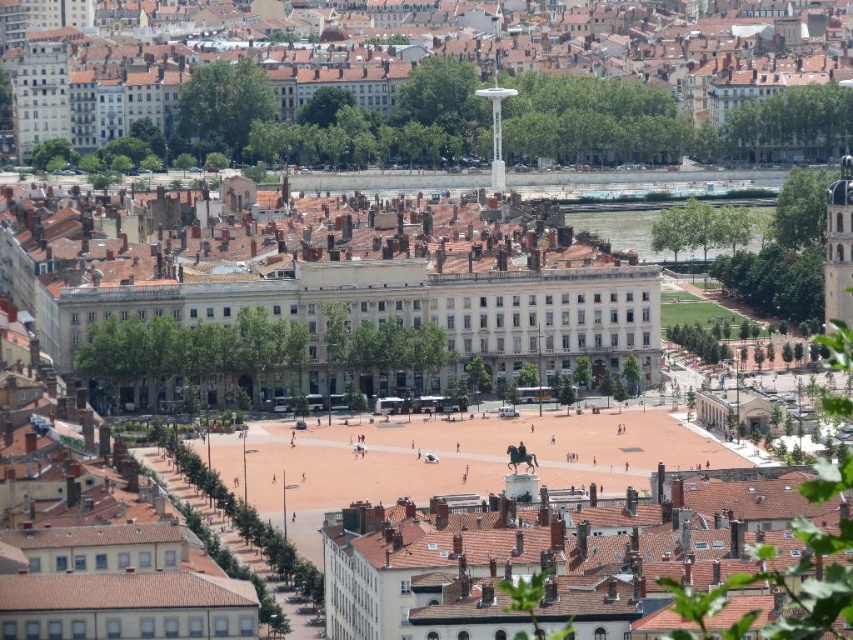
Question: Based on their relative distances, which object is nearer to the white smooth building at center?

Choices:
 (A) white glossy building at center
 (B) brown tiled roof at center

Answer: (B)

Question: Can you confirm if white smooth building at center is positioned to the right of brown tiled roof at center?

Choices:
 (A) no
 (B) yes

Answer: (A)

Question: Does white glossy building at center appear on the right side of brown tiled roof at center?

Choices:
 (A) no
 (B) yes

Answer: (A)

Question: Among these objects, which one is farthest from the camera?

Choices:
 (A) white glossy building at center
 (B) brown tiled roof at center

Answer: (A)

Question: Which object appears closest to the camera in this image?

Choices:
 (A) white smooth building at center
 (B) brown tiled roof at center
 (C) white glossy building at center

Answer: (B)

Question: Is white glossy building at center wider than brown tiled roof at center?

Choices:
 (A) yes
 (B) no

Answer: (A)